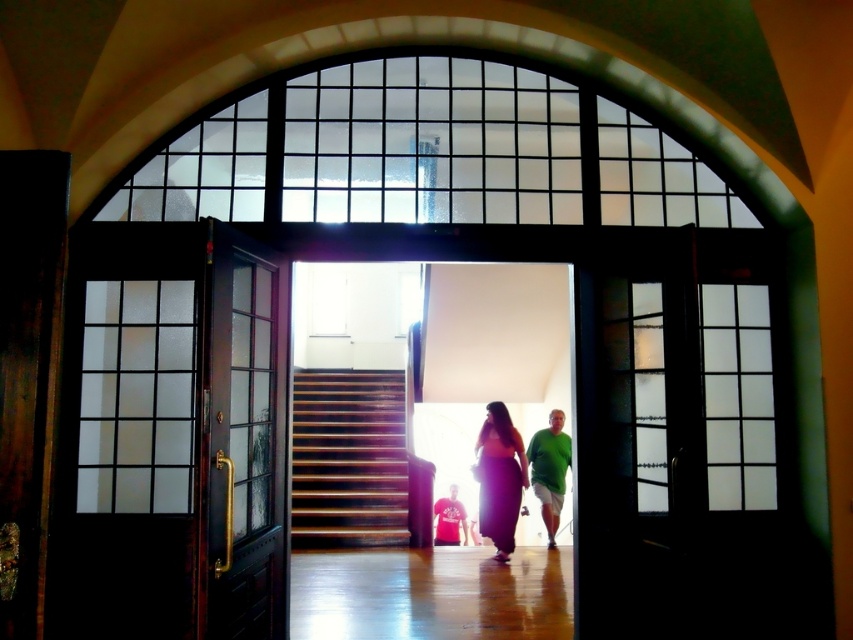
Question: Does purple satin dress at center have a smaller size compared to green matte shirt at center?

Choices:
 (A) no
 (B) yes

Answer: (A)

Question: Is wooden stairs at center to the right of green matte shirt at center from the viewer's perspective?

Choices:
 (A) yes
 (B) no

Answer: (B)

Question: Which object appears closest to the camera in this image?

Choices:
 (A) green matte shirt at center
 (B) wooden stairs at center
 (C) matte red t-shirt at center
 (D) purple satin dress at center

Answer: (D)

Question: Estimate the real-world distances between objects in this image. Which object is closer to the matte black door at left?

Choices:
 (A) matte red t-shirt at center
 (B) green matte shirt at center
 (C) wooden stairs at center

Answer: (B)

Question: Can you confirm if wooden stairs at center is positioned above green matte shirt at center?

Choices:
 (A) no
 (B) yes

Answer: (B)

Question: Which object appears farthest from the camera in this image?

Choices:
 (A) purple satin dress at center
 (B) wooden stairs at center
 (C) green matte shirt at center

Answer: (C)